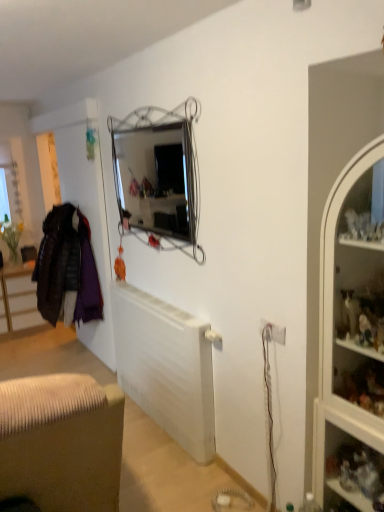
Question: Is clear glass shelves at right located outside velvet purple coat at left?

Choices:
 (A) no
 (B) yes

Answer: (B)

Question: From a real-world perspective, is clear glass shelves at right under velvet purple coat at left?

Choices:
 (A) yes
 (B) no

Answer: (A)

Question: Considering the relative sizes of clear glass shelves at right and velvet purple coat at left in the image provided, is clear glass shelves at right thinner than velvet purple coat at left?

Choices:
 (A) yes
 (B) no

Answer: (A)

Question: Is clear glass shelves at right to the left of velvet purple coat at left from the viewer's perspective?

Choices:
 (A) no
 (B) yes

Answer: (A)

Question: Is clear glass shelves at right wider than velvet purple coat at left?

Choices:
 (A) no
 (B) yes

Answer: (A)

Question: Is white matte radiator at center taller or shorter than white plastic electric outlet at lower right?

Choices:
 (A) short
 (B) tall

Answer: (B)

Question: Visually, is white matte radiator at center positioned to the left or to the right of white plastic electric outlet at lower right?

Choices:
 (A) left
 (B) right

Answer: (A)

Question: Based on their sizes in the image, would you say white matte radiator at center is bigger or smaller than white plastic electric outlet at lower right?

Choices:
 (A) big
 (B) small

Answer: (A)

Question: From the image's perspective, is white matte radiator at center positioned above or below white plastic electric outlet at lower right?

Choices:
 (A) above
 (B) below

Answer: (B)

Question: Does point (379, 404) appear closer or farther from the camera than point (82, 313)?

Choices:
 (A) closer
 (B) farther

Answer: (A)

Question: Relative to velvet purple coat at left, is white glass cabinet at right in front or behind?

Choices:
 (A) behind
 (B) front

Answer: (B)

Question: In terms of height, does white glass cabinet at right look taller or shorter compared to velvet purple coat at left?

Choices:
 (A) tall
 (B) short

Answer: (A)

Question: Which is correct: white glass cabinet at right is inside velvet purple coat at left, or outside of it?

Choices:
 (A) inside
 (B) outside

Answer: (B)

Question: From the image's perspective, is clear glass shelves at right above or below white glass cabinet at right?

Choices:
 (A) below
 (B) above

Answer: (A)

Question: Considering the positions of clear glass shelves at right and white glass cabinet at right in the image, is clear glass shelves at right wider or thinner than white glass cabinet at right?

Choices:
 (A) thin
 (B) wide

Answer: (A)